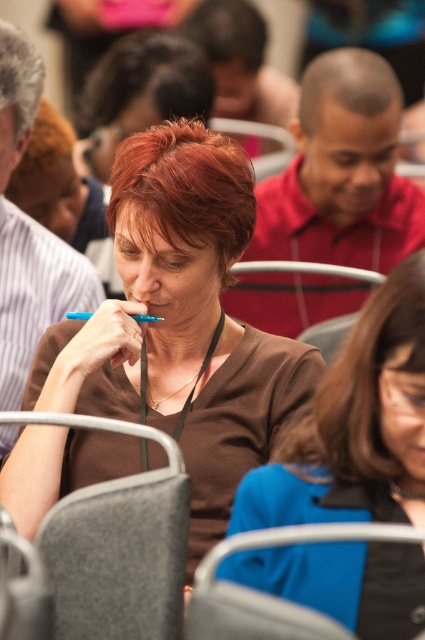
You are a photographer adjusting your camera settings to focus on two specific points in the image. The first point is labeled as point [328,556] and the second is point [231,600]. Which point should you focus on first if you want to ensure the closest object to the camera is in focus?

Point [328,556] is further to the camera than point [231,600]. Therefore, to focus on the closest object, you should focus on point [231,600] first.